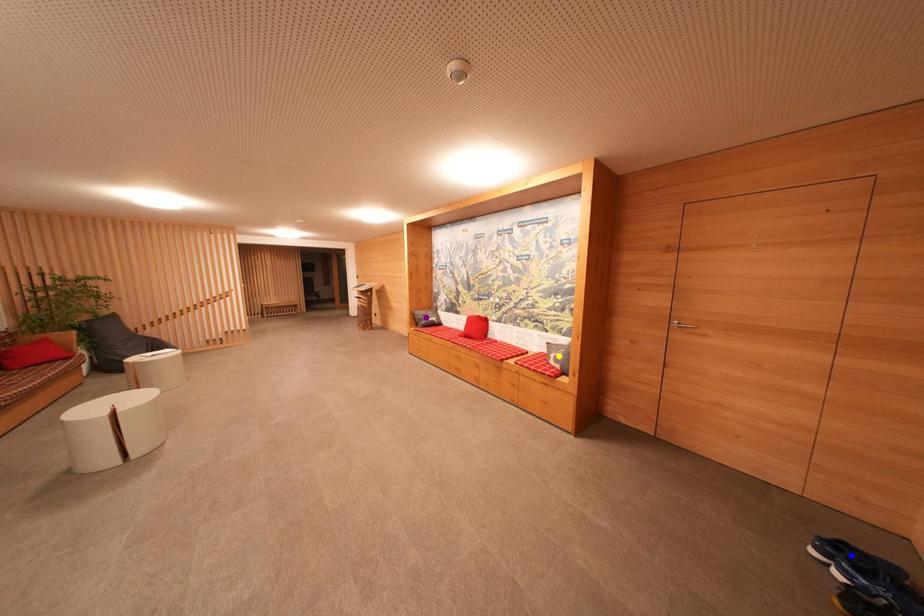
Order these from nearest to farthest:
1. blue point
2. yellow point
3. purple point

1. blue point
2. yellow point
3. purple point